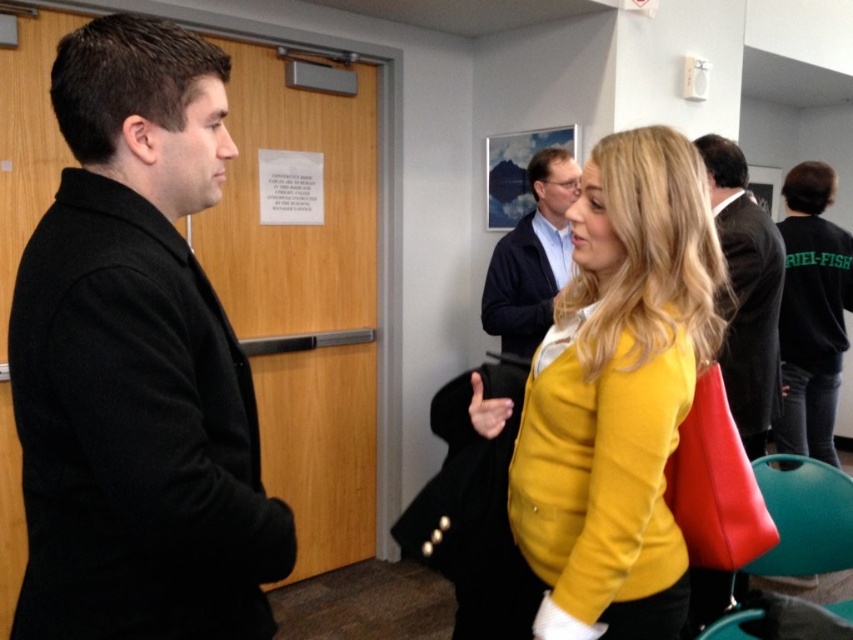
Question: Is black wool coat at left to the left of yellow matte jacket at center from the viewer's perspective?

Choices:
 (A) no
 (B) yes

Answer: (B)

Question: Which object is farther from the camera taking this photo?

Choices:
 (A) yellow matte jacket at center
 (B) blue fabric jacket at center
 (C) black wool coat at left
 (D) dark gray suit at center

Answer: (B)

Question: Among these objects, which one is farthest from the camera?

Choices:
 (A) blue fabric jacket at center
 (B) black wool coat at left
 (C) dark gray suit at center
 (D) yellow matte jacket at center

Answer: (A)

Question: In this image, where is black wool coat at left located relative to yellow matte jacket at center?

Choices:
 (A) above
 (B) below

Answer: (A)

Question: Considering the real-world distances, which object is farthest from the dark gray suit at center?

Choices:
 (A) black wool coat at left
 (B) yellow matte jacket at center

Answer: (A)

Question: Is black wool coat at left positioned in front of blue fabric jacket at center?

Choices:
 (A) no
 (B) yes

Answer: (B)